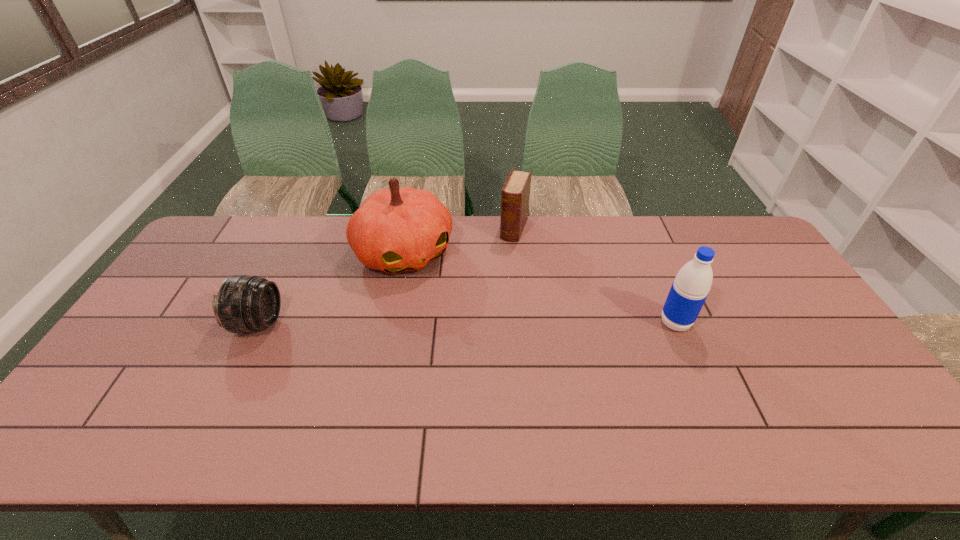
At what (x,y) coordinates should I click in order to perform the action: click on vacant space at the far left corner of the desktop. Please return your answer as a coordinate pair (x, y). This screenshot has height=540, width=960. Looking at the image, I should click on (228, 215).

Locate an element on the screen. This screenshot has height=540, width=960. free space at the near left corner is located at coordinates (151, 398).

The width and height of the screenshot is (960, 540). Identify the location of vacant region between the second object from right to left and the pumpkin. (459, 241).

Identify the location of vacant space that's between the second object from left to right and the diary. (459, 241).

Where is `empty space that is in between the second object from left to right and the rightmost object`? empty space that is in between the second object from left to right and the rightmost object is located at coordinates (540, 288).

Where is `vacant point located between the pumpkin and the rightmost object`? vacant point located between the pumpkin and the rightmost object is located at coordinates (540, 288).

You are a GUI agent. You are given a task and a screenshot of the screen. Output one action in this format:
    pyautogui.click(x=<x>, y=<y>)
    Task: Click on the blank region between the third object from left to right and the pumpkin
    The image size is (960, 540).
    Given the screenshot: What is the action you would take?
    pyautogui.click(x=459, y=241)

Identify the location of free spot between the rightmost object and the diary. The width and height of the screenshot is (960, 540). click(595, 276).

Identify the location of vacant area that lies between the second object from right to left and the rightmost object. (595, 276).

Locate an element on the screen. The width and height of the screenshot is (960, 540). empty location between the rightmost object and the shortest object is located at coordinates (467, 323).